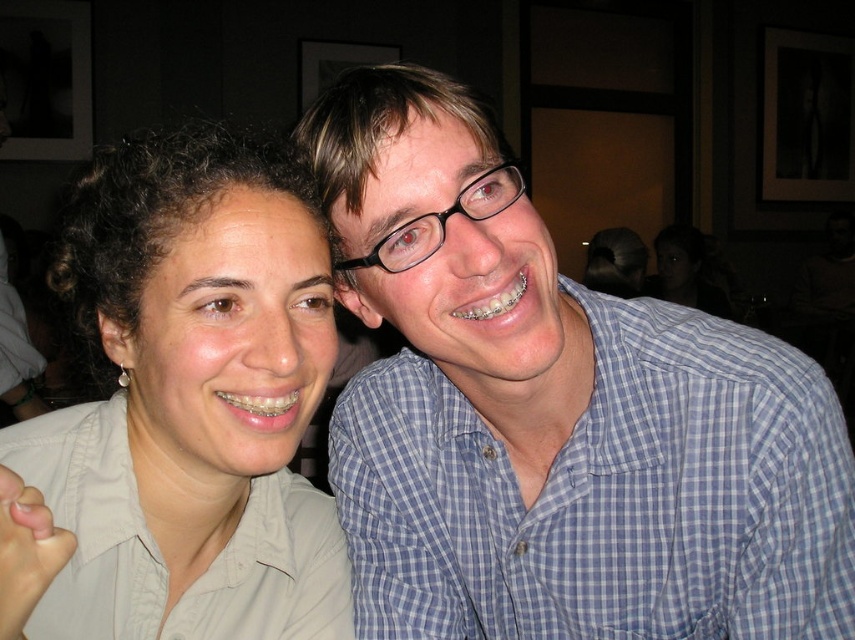
Question: Does matte khaki shirt at left appear on the right side of blue checkered shirt at right?

Choices:
 (A) no
 (B) yes

Answer: (A)

Question: Which of the following is the closest to the observer?

Choices:
 (A) (111, 612)
 (B) (691, 433)

Answer: (A)

Question: Which of the following is the farthest from the observer?

Choices:
 (A) matte khaki shirt at left
 (B) blue checkered shirt at right

Answer: (B)

Question: Is matte khaki shirt at left positioned in front of blue checkered shirt at right?

Choices:
 (A) yes
 (B) no

Answer: (A)

Question: Is matte khaki shirt at left wider than blue checkered shirt at right?

Choices:
 (A) no
 (B) yes

Answer: (A)

Question: Which of the following is the farthest from the observer?

Choices:
 (A) blue checkered shirt at right
 (B) matte khaki shirt at left

Answer: (A)